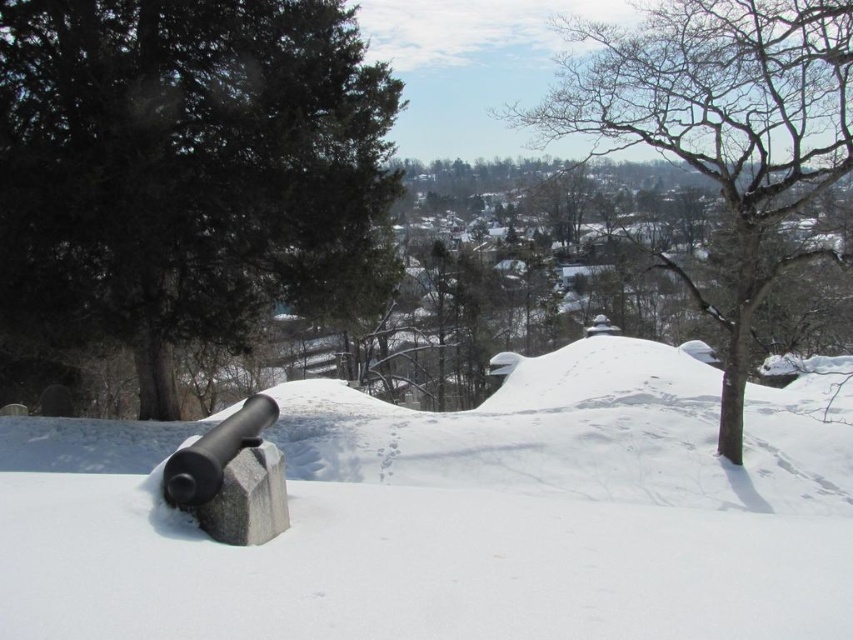
You are an observer standing at the base of the cannon in the snowy landscape. You notice two trees in the distance. Which tree, the dark green textured tree at upper left or the bare wood tree at upper right, is closer to you?

The dark green textured tree at upper left is closer to you because it is further to the viewer than the bare wood tree at upper right.

You are a hiker trying to navigate through the snowy landscape. You see the bare wood tree at upper right and the gray stone cannon at lower left. Which object is higher in elevation from your viewpoint?

The bare wood tree at upper right is above the gray stone cannon at lower left, so it is higher in elevation from your viewpoint.

You are an explorer trying to navigate through the snowy landscape. You need to reach the town in the background. Which direction should you head from the cannon to avoid the white matte snow at center and the bare wood tree at upper right?

To avoid the white matte snow at center and the bare wood tree at upper right, you should head towards the valley below as the cannon is pointing there, which is likely the direction away from both objects. The white matte snow at center is to the left of the bare wood tree at upper right, so moving towards the valley would take you in the opposite direction.